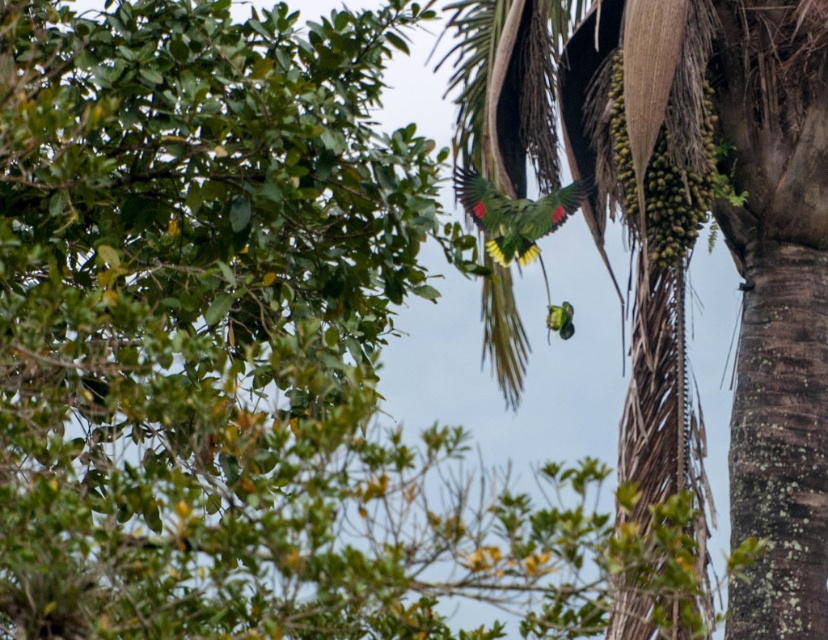
Question: Which object appears closest to the camera in this image?

Choices:
 (A) green matte parrot at center
 (B) green leafy coconut tree at upper right

Answer: (B)

Question: Can you confirm if green leafy coconut tree at upper right is wider than green matte parrot at center?

Choices:
 (A) yes
 (B) no

Answer: (A)

Question: Which point is closer to the camera taking this photo?

Choices:
 (A) (526, 236)
 (B) (499, 308)

Answer: (A)

Question: Can you confirm if green leafy coconut tree at upper right is smaller than green matte parrot at center?

Choices:
 (A) yes
 (B) no

Answer: (B)

Question: Is green leafy coconut tree at upper right thinner than green matte parrot at center?

Choices:
 (A) yes
 (B) no

Answer: (B)